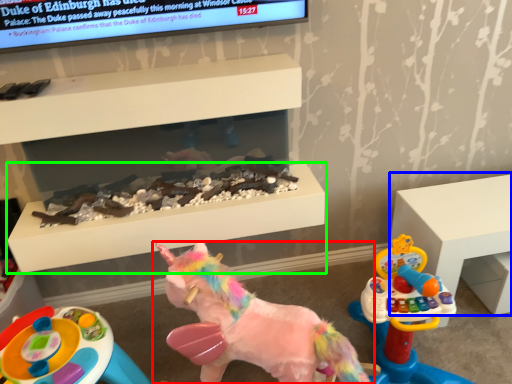
Question: Considering the real-world distances, which object is closest to toy (highlighted by a red box)? furniture (highlighted by a blue box) or table (highlighted by a green box).

Choices:
 (A) furniture
 (B) table

Answer: (B)